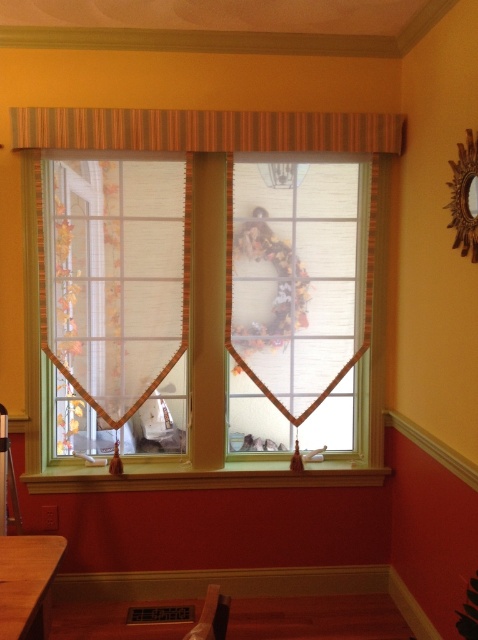
You are an interior designer planning to hang a new picture frame between the translucent fabric valance at center and the matte fabric wreath at center. Based on their positions, where should you place the frame?

The translucent fabric valance at center is above the matte fabric wreath at center, so the picture frame should be placed between them by positioning it below the translucent fabric valance at center and above the matte fabric wreath at center.

You are trying to hang a new picture frame on the wall between the translucent fabric valance at center and the brown wooden table at lower left. To ensure it fits, you need to know which object is wider. Can you determine which one is wider?

The translucent fabric valance at center might be wider than brown wooden table at lower left, so it is possible that the valance is wider. However, since the description uses the word

You are an interior designer assessing the window decor. You need to determine which valance is positioned lower relative to the other. Which valance is lower between the translucent fabric valance at center and the striped fabric valance at upper center?

The translucent fabric valance at center is positioned lower than the striped fabric valance at upper center because it is described as much taller, implying it extends downward from the upper center valance.